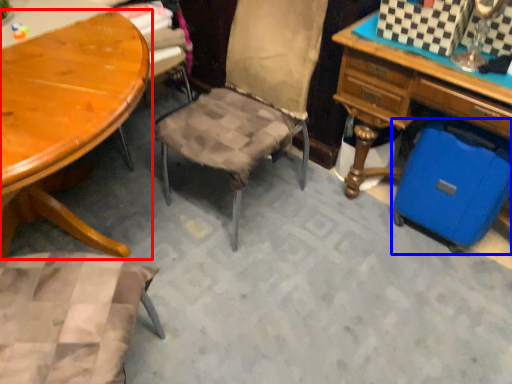
Question: Which point is closer to the camera, table (highlighted by a red box) or luggage (highlighted by a blue box)?

Choices:
 (A) table
 (B) luggage

Answer: (A)